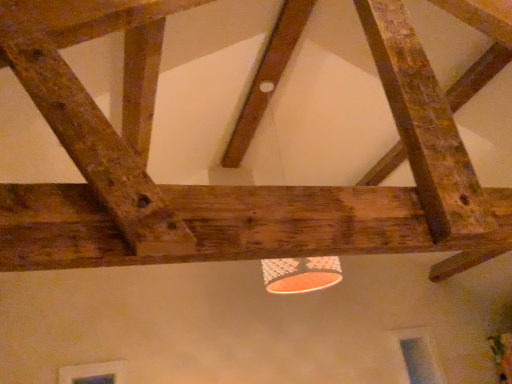
Locate an element on the screen. The width and height of the screenshot is (512, 384). rustic wood beam at center, acting as the 1th plank starting from the back is located at coordinates (267, 77).

The height and width of the screenshot is (384, 512). Find the location of `rustic wood beam at upper center, positioned as the 3th plank in right-to-left order`. rustic wood beam at upper center, positioned as the 3th plank in right-to-left order is located at coordinates (97, 148).

In order to click on plank located behind the rustic wood beam at upper right, positioned as the 3th plank in left-to-right order in this screenshot , I will do `click(267, 77)`.

Can you tell me how much rustic wood beam at upper right, positioned as the 3th plank in left-to-right order, and rustic wood beam at center, the second plank viewed from the right, differ in facing direction?

They differ by 180 degrees in their facing directions.

Could you tell me if rustic wood beam at upper right, marked as the 1th plank in a right-to-left arrangement, is facing rustic wood beam at center, the 2th plank positioned from the left?

No, rustic wood beam at upper right, marked as the 1th plank in a right-to-left arrangement, is not turned towards rustic wood beam at center, the 2th plank positioned from the left.

Is rustic wood beam at upper right, acting as the 2th plank starting from the front, situated inside rustic wood beam at center, the 2th plank positioned from the left, or outside?

rustic wood beam at upper right, acting as the 2th plank starting from the front, exists outside the volume of rustic wood beam at center, the 2th plank positioned from the left.

Considering the sizes of rustic wood beam at center, acting as the 1th plank starting from the back, and rustic wood beam at upper right, the second plank viewed from the back, in the image, is rustic wood beam at center, acting as the 1th plank starting from the back, wider or thinner than rustic wood beam at upper right, the second plank viewed from the back,?

Clearly, rustic wood beam at center, acting as the 1th plank starting from the back, has more width compared to rustic wood beam at upper right, the second plank viewed from the back.

Looking at this image, is rustic wood beam at center, acting as the 1th plank starting from the back, further to the viewer compared to rustic wood beam at upper right, acting as the 2th plank starting from the front?

Yes, it is.

In the image, is rustic wood beam at center, the second plank viewed from the right, on the left side or the right side of rustic wood beam at upper right, marked as the 1th plank in a right-to-left arrangement?

rustic wood beam at center, the second plank viewed from the right, is positioned on rustic wood beam at upper right, marked as the 1th plank in a right-to-left arrangement,'s left side.

From the image's perspective, is rustic wood beam at upper center, the first plank positioned from the front, located above or below rustic wood beam at center, the 3th plank in the front-to-back sequence?

Clearly, from the image's perspective, rustic wood beam at upper center, the first plank positioned from the front, is below rustic wood beam at center, the 3th plank in the front-to-back sequence.

How different are the orientations of rustic wood beam at upper center, positioned as the 3th plank in right-to-left order, and rustic wood beam at center, the 3th plank in the front-to-back sequence, in degrees?

There is a 178-degree angle between the facing directions of rustic wood beam at upper center, positioned as the 3th plank in right-to-left order, and rustic wood beam at center, the 3th plank in the front-to-back sequence.

Looking at their sizes, would you say rustic wood beam at upper center, which is the first plank in left-to-right order, is wider or thinner than rustic wood beam at center, the 3th plank in the front-to-back sequence?

Considering their sizes, rustic wood beam at upper center, which is the first plank in left-to-right order, looks slimmer than rustic wood beam at center, the 3th plank in the front-to-back sequence.

Measure the distance from rustic wood beam at upper center, which is the 3th plank in back-to-front order, to rustic wood beam at center, acting as the 1th plank starting from the back.

The distance of rustic wood beam at upper center, which is the 3th plank in back-to-front order, from rustic wood beam at center, acting as the 1th plank starting from the back, is 1.60 meters.

Which of these two, rustic wood beam at upper center, positioned as the 3th plank in right-to-left order, or rustic wood beam at upper right, positioned as the 3th plank in left-to-right order, is thinner?

Thinner between the two is rustic wood beam at upper right, positioned as the 3th plank in left-to-right order.

From the picture: Does rustic wood beam at upper center, which is the 3th plank in back-to-front order, touch rustic wood beam at upper right, positioned as the 3th plank in left-to-right order?

No, rustic wood beam at upper center, which is the 3th plank in back-to-front order, is not with rustic wood beam at upper right, positioned as the 3th plank in left-to-right order.

From the image's perspective, is rustic wood beam at upper center, positioned as the 3th plank in right-to-left order, beneath rustic wood beam at upper right, marked as the 1th plank in a right-to-left arrangement?

Correct, rustic wood beam at upper center, positioned as the 3th plank in right-to-left order, appears lower than rustic wood beam at upper right, marked as the 1th plank in a right-to-left arrangement, in the image.

Is there a large distance between rustic wood beam at upper right, acting as the 2th plank starting from the front, and rustic wood beam at upper center, the first plank positioned from the front?

Actually, rustic wood beam at upper right, acting as the 2th plank starting from the front, and rustic wood beam at upper center, the first plank positioned from the front, are a little close together.

From a real-world perspective, is rustic wood beam at upper right, marked as the 1th plank in a right-to-left arrangement, on top of rustic wood beam at upper center, which is the first plank in left-to-right order?

Yes.

Considering the points (465, 169) and (53, 125), which point is behind, point (465, 169) or point (53, 125)?

The point (465, 169) is behind.

Considering the sizes of objects rustic wood beam at center, acting as the 1th plank starting from the back, and rustic wood beam at upper center, the first plank positioned from the front, in the image provided, who is shorter, rustic wood beam at center, acting as the 1th plank starting from the back, or rustic wood beam at upper center, the first plank positioned from the front,?

Standing shorter between the two is rustic wood beam at center, acting as the 1th plank starting from the back.

From a real-world perspective, is rustic wood beam at center, acting as the 1th plank starting from the back, positioned above or below rustic wood beam at upper center, which is the first plank in left-to-right order?

Clearly, from a real-world perspective, rustic wood beam at center, acting as the 1th plank starting from the back, is above rustic wood beam at upper center, which is the first plank in left-to-right order.

Which is in front, point (240, 150) or point (15, 69)?

Positioned in front is point (15, 69).

Is rustic wood beam at center, the 3th plank in the front-to-back sequence, far away from rustic wood beam at upper center, which is the 3th plank in back-to-front order?

Yes, rustic wood beam at center, the 3th plank in the front-to-back sequence, and rustic wood beam at upper center, which is the 3th plank in back-to-front order, are located far from each other.

What are the coordinates of `plank that is the 1st one when counting forward from the rustic wood beam at center, the 3th plank in the front-to-back sequence` in the screenshot? It's located at (425, 126).

Identify the location of plank behind the rustic wood beam at upper right, positioned as the 3th plank in left-to-right order. The height and width of the screenshot is (384, 512). (267, 77).

Which object lies further to the anchor point rustic wood beam at upper right, marked as the 1th plank in a right-to-left arrangement, rustic wood beam at upper center, which is the first plank in left-to-right order, or rustic wood beam at center, acting as the 1th plank starting from the back?

rustic wood beam at center, acting as the 1th plank starting from the back.

Looking at the image, which one is located closer to rustic wood beam at upper center, the first plank positioned from the front, rustic wood beam at center, acting as the 1th plank starting from the back, or rustic wood beam at upper right, the second plank viewed from the back?

Among the two, rustic wood beam at upper right, the second plank viewed from the back, is located nearer to rustic wood beam at upper center, the first plank positioned from the front.

Considering their positions, is rustic wood beam at center, the 3th plank in the front-to-back sequence, positioned closer to rustic wood beam at upper right, marked as the 1th plank in a right-to-left arrangement, than rustic wood beam at upper center, which is the 3th plank in back-to-front order?

rustic wood beam at upper center, which is the 3th plank in back-to-front order.

Considering their positions, is rustic wood beam at upper right, positioned as the 3th plank in left-to-right order, positioned closer to rustic wood beam at center, the 2th plank positioned from the left, than rustic wood beam at upper center, the first plank positioned from the front?

rustic wood beam at upper right, positioned as the 3th plank in left-to-right order.

Considering their positions, is rustic wood beam at upper right, acting as the 2th plank starting from the front, positioned further to rustic wood beam at upper center, which is the first plank in left-to-right order, than rustic wood beam at center, the 3th plank in the front-to-back sequence?

The object further to rustic wood beam at upper center, which is the first plank in left-to-right order, is rustic wood beam at center, the 3th plank in the front-to-back sequence.

Which object lies nearer to the anchor point rustic wood beam at center, acting as the 1th plank starting from the back, rustic wood beam at upper center, which is the first plank in left-to-right order, or rustic wood beam at upper right, marked as the 1th plank in a right-to-left arrangement?

rustic wood beam at upper right, marked as the 1th plank in a right-to-left arrangement, is closer to rustic wood beam at center, acting as the 1th plank starting from the back.

Find the location of a particular element. The height and width of the screenshot is (384, 512). plank positioned between rustic wood beam at upper center, which is the 3th plank in back-to-front order, and rustic wood beam at center, the 3th plank in the front-to-back sequence, from near to far is located at coordinates (425, 126).